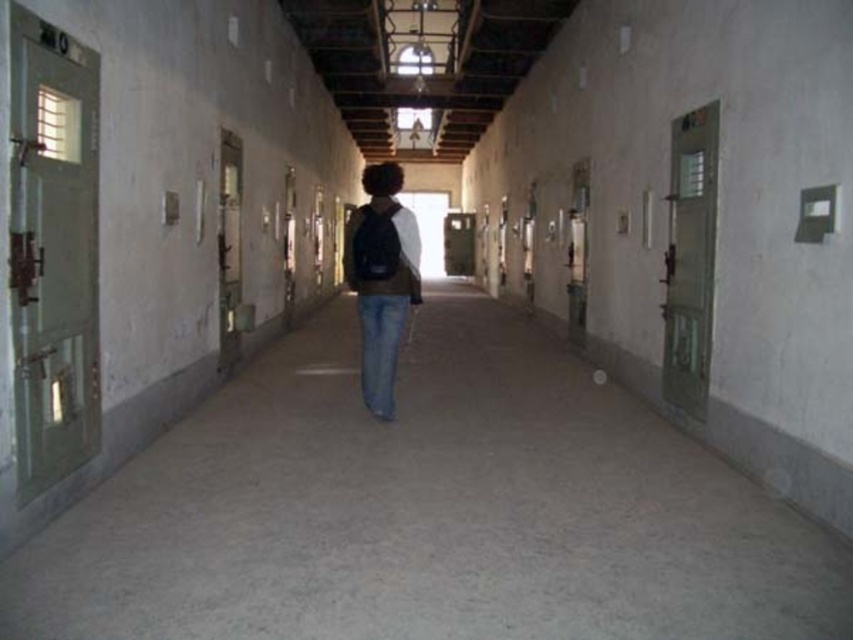
Question: Does denim jeans at center appear over blue denim jeans at center?

Choices:
 (A) no
 (B) yes

Answer: (B)

Question: Which point is closer to the camera?

Choices:
 (A) (387, 412)
 (B) (367, 214)

Answer: (B)

Question: Which point is closer to the camera?

Choices:
 (A) blue denim jeans at center
 (B) denim jeans at center

Answer: (B)

Question: Can you confirm if denim jeans at center is positioned below blue denim jeans at center?

Choices:
 (A) yes
 (B) no

Answer: (B)

Question: Among these points, which one is nearest to the camera?

Choices:
 (A) (381, 173)
 (B) (387, 356)

Answer: (B)

Question: Can you confirm if denim jeans at center is wider than blue denim jeans at center?

Choices:
 (A) no
 (B) yes

Answer: (B)